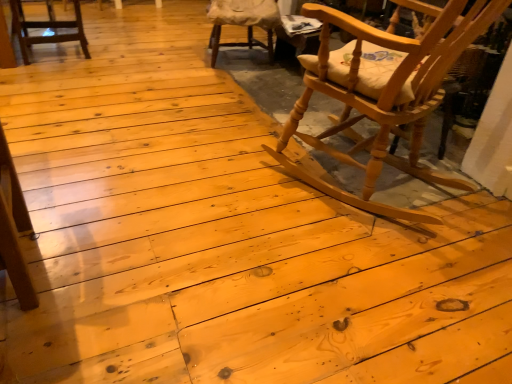
In order to click on empty space that is in between matte wood chair at upper left, which is the 2th chair in back-to-front order, and wooden cushioned chair at upper center, positioned as the second chair in right-to-left order in this screenshot , I will do point(143,57).